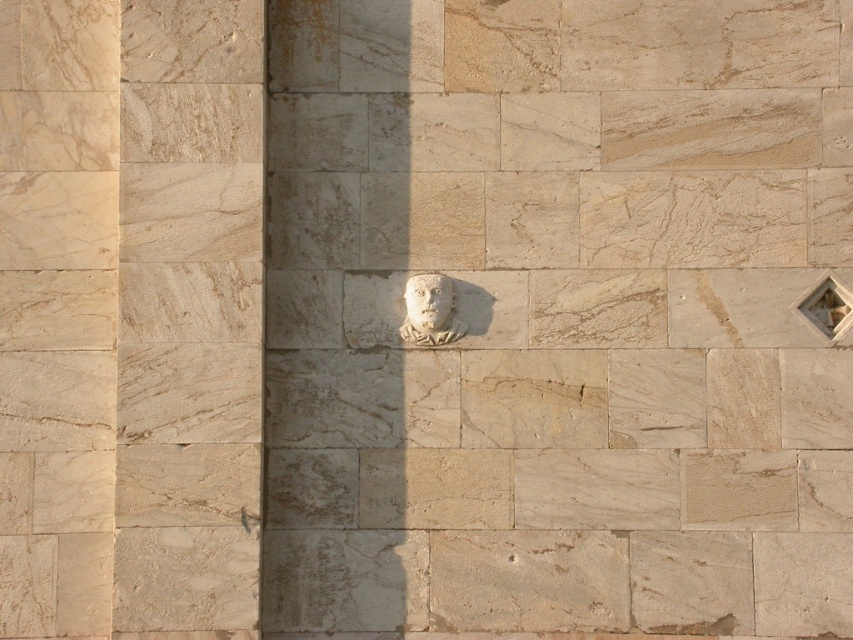
You are an architect designing a new building and want to incorporate both the beige marble pillar at center and the white stone face at center into a wall design. Considering their widths, which object should you place first if you want to ensure there is enough space for both?

The beige marble pillar at center is wider than the white stone face at center. To ensure there is enough space for both, you should place the beige marble pillar at center first, then position the white stone face at center next to it.

From the picture: You are an interior designer planning to place a beige marble pillar at center and a white stone bust at center in a room. Given their sizes, which object should be placed closer to the entrance to make the layout more balanced?

The beige marble pillar at center is larger in size than the white stone bust at center, so placing the larger beige marble pillar at center closer to the entrance will create a balanced layout as larger objects are typically positioned at focal points.

You are an artist examining the wall and want to touch both the white stone bust at center and the white stone face at center. Which one should you reach for first to touch the one closer to you?

You should touch the white stone bust at center first because it is closer to you than the white stone face at center.